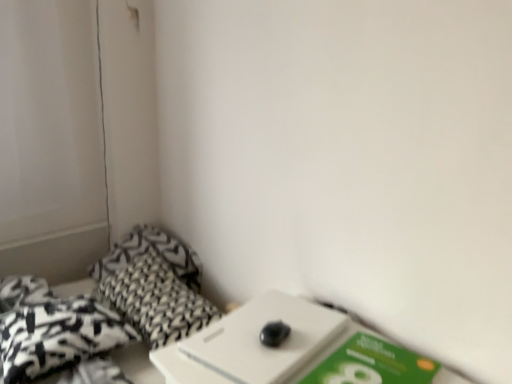
Question: Is black printed fabric at lower left closer to the viewer compared to black textured pillow at lower left, the 2th pillow in the back-to-front sequence?

Choices:
 (A) no
 (B) yes

Answer: (B)

Question: Is black printed fabric at lower left not near black textured pillow at lower left, the 2th pillow in the back-to-front sequence?

Choices:
 (A) yes
 (B) no

Answer: (B)

Question: Can you confirm if black printed fabric at lower left is smaller than black textured pillow at lower left, the 2th pillow in the back-to-front sequence?

Choices:
 (A) no
 (B) yes

Answer: (A)

Question: Considering the relative sizes of black printed fabric at lower left and black textured pillow at lower left, the 2th pillow in the back-to-front sequence, in the image provided, is black printed fabric at lower left taller than black textured pillow at lower left, the 2th pillow in the back-to-front sequence,?

Choices:
 (A) yes
 (B) no

Answer: (A)

Question: Is black printed fabric at lower left shorter than black textured pillow at lower left, the 2th pillow in the back-to-front sequence?

Choices:
 (A) yes
 (B) no

Answer: (B)

Question: In terms of width, does black printed fabric at lower left look wider or thinner when compared to green matte paperback book at lower right?

Choices:
 (A) wide
 (B) thin

Answer: (A)

Question: In the image, is black printed fabric at lower left on the left side or the right side of green matte paperback book at lower right?

Choices:
 (A) left
 (B) right

Answer: (A)

Question: From the image's perspective, is black printed fabric at lower left above or below green matte paperback book at lower right?

Choices:
 (A) above
 (B) below

Answer: (B)

Question: In terms of size, does black printed fabric at lower left appear bigger or smaller than green matte paperback book at lower right?

Choices:
 (A) small
 (B) big

Answer: (B)

Question: Is point (134, 294) positioned closer to the camera than point (154, 241)?

Choices:
 (A) closer
 (B) farther

Answer: (A)

Question: Looking at their shapes, would you say black textured pillow at lower left, the 2th pillow in the back-to-front sequence, is wider or thinner than black printed fabric at lower left?

Choices:
 (A) wide
 (B) thin

Answer: (B)

Question: Would you say black textured pillow at lower left, the 2th pillow in the back-to-front sequence, is to the left or to the right of black printed fabric at lower left in the picture?

Choices:
 (A) right
 (B) left

Answer: (A)

Question: From the image's perspective, is black textured pillow at lower left, the 2th pillow in the back-to-front sequence, located above or below black printed fabric at lower left?

Choices:
 (A) above
 (B) below

Answer: (A)

Question: Is black printed fabric at lower left taller or shorter than black textured pillow at lower left, the 1th pillow from the front?

Choices:
 (A) tall
 (B) short

Answer: (A)

Question: Based on their sizes in the image, would you say black printed fabric at lower left is bigger or smaller than black textured pillow at lower left, the 1th pillow from the front?

Choices:
 (A) big
 (B) small

Answer: (A)